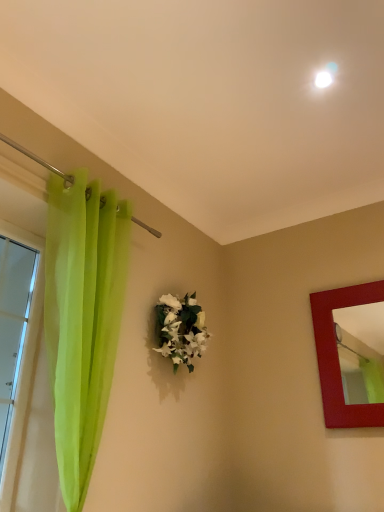
Question: Is point (317, 348) positioned closer to the camera than point (19, 388)?

Choices:
 (A) farther
 (B) closer

Answer: (A)

Question: Which is correct: matte red picture frame at right is inside transparent green curtain at left, or outside of it?

Choices:
 (A) outside
 (B) inside

Answer: (A)

Question: Based on their relative distances, which object is nearer to the transparent green curtain at left?

Choices:
 (A) white matte floral arrangement at center
 (B) matte red picture frame at right

Answer: (A)

Question: Which object is the farthest from the transparent green curtain at left?

Choices:
 (A) matte red picture frame at right
 (B) white matte floral arrangement at center

Answer: (A)